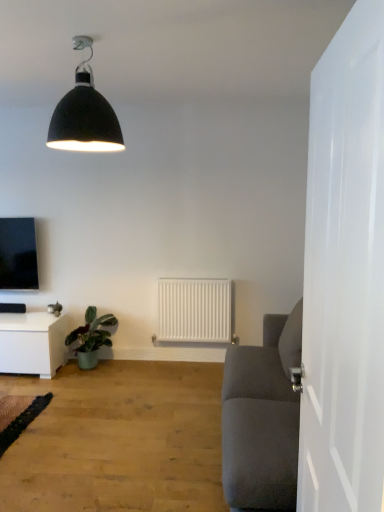
The height and width of the screenshot is (512, 384). In order to click on empty space that is ontop of light brown wood floor at lower left (from a real-world perspective) in this screenshot , I will do `click(72, 414)`.